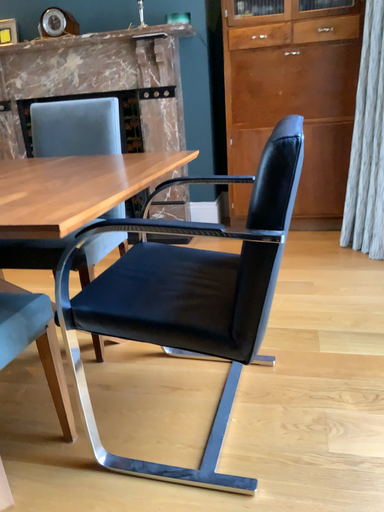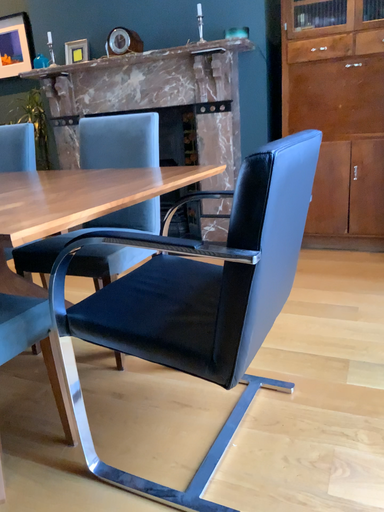
Question: Which way did the camera rotate in the video?

Choices:
 (A) rotated left
 (B) rotated right

Answer: (A)